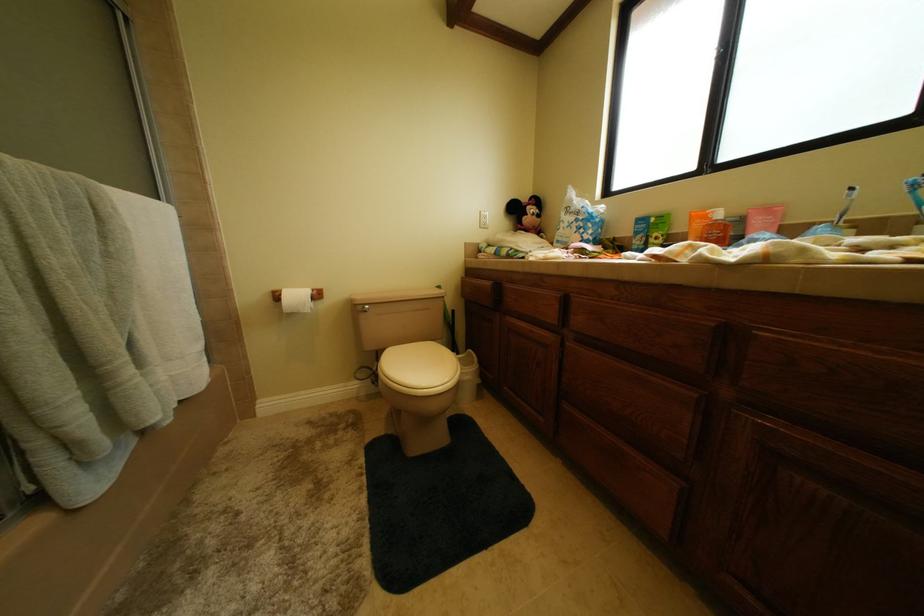
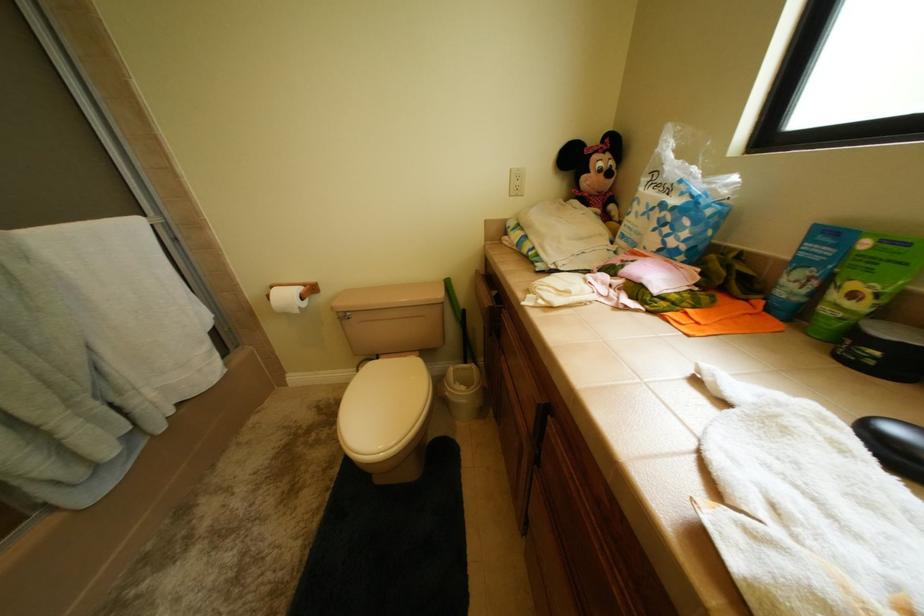
Based on the continuous images, in which direction is the camera rotating?

The camera rotated toward left-down.